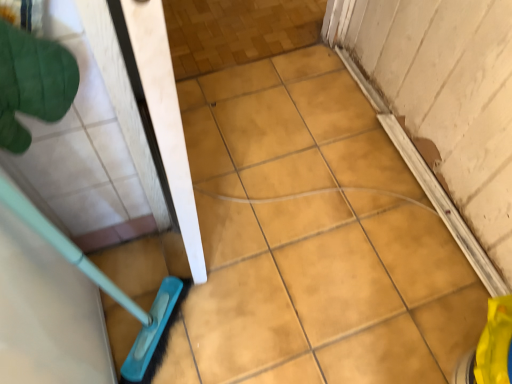
Find the location of a particular element. free point behind yellow matte tile at lower right, which appears as the 2th ceramic tile when viewed from the left is located at coordinates (431, 273).